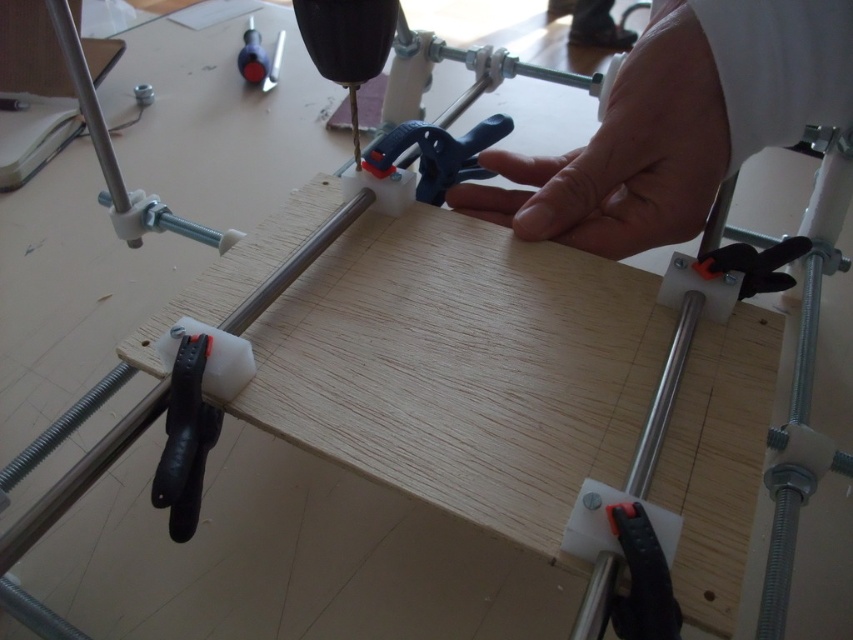
Question: Which point appears farthest from the camera in this image?

Choices:
 (A) (258, 51)
 (B) (694, 202)

Answer: (A)

Question: Which of the following is the closest to the observer?

Choices:
 (A) blue plastic clamp at center
 (B) matte plastic screwdriver at upper left

Answer: (A)

Question: Which object is farther from the camera taking this photo?

Choices:
 (A) blue plastic clamp at center
 (B) skinny white hand at center
 (C) matte plastic screwdriver at upper left

Answer: (C)

Question: Does skinny white hand at center have a lesser width compared to blue plastic clamp at center?

Choices:
 (A) yes
 (B) no

Answer: (B)

Question: Can you confirm if skinny white hand at center is positioned to the right of matte plastic screwdriver at upper left?

Choices:
 (A) yes
 (B) no

Answer: (A)

Question: Can you confirm if skinny white hand at center is positioned above matte plastic screwdriver at upper left?

Choices:
 (A) yes
 (B) no

Answer: (B)